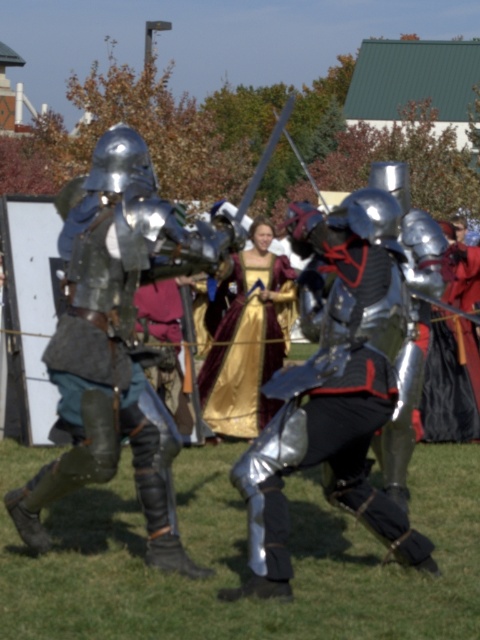
Is shiny silver armor at center in front of gold satin dress at center?

That is True.

Who is shorter, shiny silver armor at center or gold satin dress at center?

With less height is gold satin dress at center.

Does point (391, 536) come closer to viewer compared to point (219, 337)?

That is True.

At what (x,y) coordinates should I click in order to perform the action: click on shiny silver armor at center. Please return your answer as a coordinate pair (x, y). Looking at the image, I should click on (334, 390).

Does shiny silver armor at left appear under shiny silver armor at center?

Incorrect, shiny silver armor at left is not positioned below shiny silver armor at center.

Who is higher up, shiny silver armor at left or shiny silver armor at center?

shiny silver armor at left is higher up.

Between point (86, 257) and point (332, 486), which one is positioned in front?

Point (86, 257) is in front.

The height and width of the screenshot is (640, 480). What are the coordinates of `shiny silver armor at left` in the screenshot? It's located at (113, 348).

Does shiny silver armor at left lie behind gold satin dress at center?

No, it is in front of gold satin dress at center.

Find the location of a particular element. shiny silver armor at left is located at coordinates (x=113, y=348).